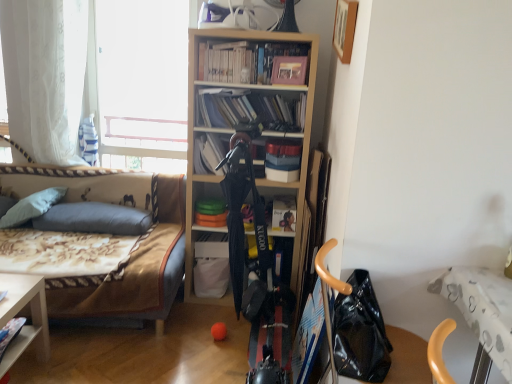
The height and width of the screenshot is (384, 512). I want to click on unoccupied region to the right of orange matte ball at center, so click(x=238, y=337).